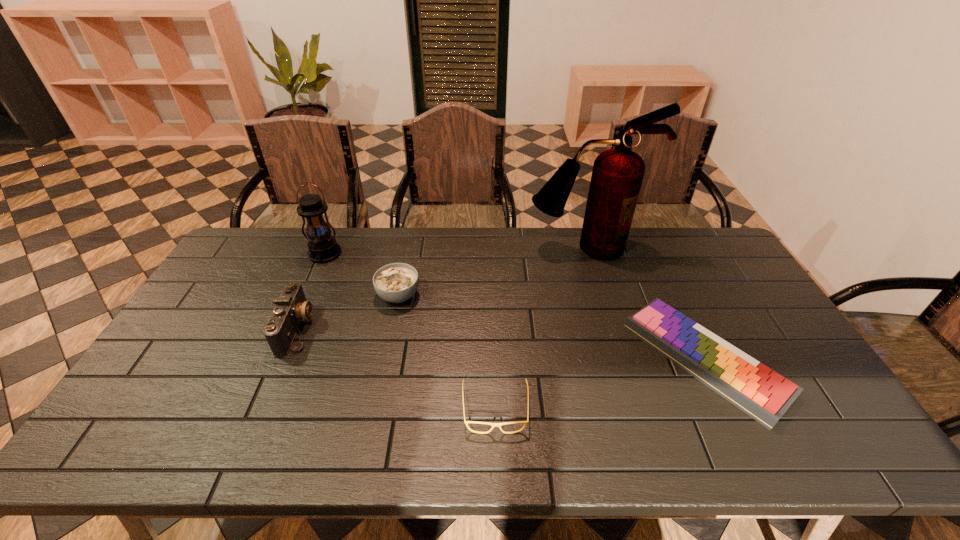
Where is `empty space between the tallest object and the third shortest object`? This screenshot has width=960, height=540. empty space between the tallest object and the third shortest object is located at coordinates (492, 272).

The height and width of the screenshot is (540, 960). In order to click on vacant space that is in between the soup bowl and the fire extinguisher in this screenshot , I will do `click(492, 272)`.

You are a GUI agent. You are given a task and a screenshot of the screen. Output one action in this format:
    pyautogui.click(x=<x>, y=<y>)
    Task: Click on the free space between the computer keyboard and the tallest object
    
    Given the screenshot: What is the action you would take?
    pyautogui.click(x=645, y=303)

Where is `vacant area between the fire extinguisher and the spectacles`? This screenshot has width=960, height=540. vacant area between the fire extinguisher and the spectacles is located at coordinates (540, 328).

Image resolution: width=960 pixels, height=540 pixels. I want to click on the second closest object to the camera, so click(322, 247).

The height and width of the screenshot is (540, 960). Identify the location of object that ranks as the fifth closest to the lantern. (762, 393).

The height and width of the screenshot is (540, 960). In order to click on free space that satisfies the following two spatial constraints: 1. on the front-facing side of the third tallest object; 2. on the left side of the computer keyboard in this screenshot , I will do `click(284, 360)`.

Where is `free spot that satisfies the following two spatial constraints: 1. on the front side of the soup bowl; 2. on the front-facing side of the camera`? The height and width of the screenshot is (540, 960). free spot that satisfies the following two spatial constraints: 1. on the front side of the soup bowl; 2. on the front-facing side of the camera is located at coordinates (392, 328).

Image resolution: width=960 pixels, height=540 pixels. I want to click on blank space that satisfies the following two spatial constraints: 1. above the second tallest object, indicating its light source; 2. on the left side of the computer keyboard, so click(279, 360).

Image resolution: width=960 pixels, height=540 pixels. I want to click on free space in the image that satisfies the following two spatial constraints: 1. on the front-facing side of the computer keyboard; 2. on the right side of the camera, so click(284, 360).